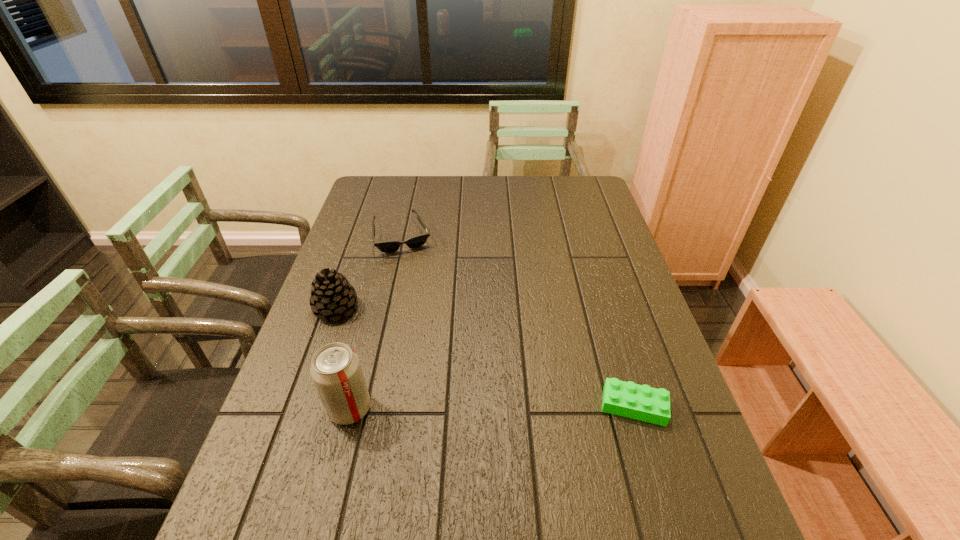
I want to click on soda can, so click(x=336, y=371).

You are a GUI agent. You are given a task and a screenshot of the screen. Output one action in this format:
    pyautogui.click(x=<x>, y=<y>)
    Task: Click on the Lego
    
    Given the screenshot: What is the action you would take?
    pyautogui.click(x=641, y=402)

The height and width of the screenshot is (540, 960). In order to click on the second farthest object in this screenshot , I will do `click(332, 296)`.

Locate an element on the screen. The image size is (960, 540). the third shortest object is located at coordinates (332, 296).

You are a GUI agent. You are given a task and a screenshot of the screen. Output one action in this format:
    pyautogui.click(x=<x>, y=<y>)
    Task: Click on the sunglasses
    
    Given the screenshot: What is the action you would take?
    pyautogui.click(x=416, y=241)

At what (x,y) coordinates should I click in order to perform the action: click on vacant space located on the right of the soda can. Please return your answer as a coordinate pair (x, y). This screenshot has width=960, height=540. Looking at the image, I should click on (510, 408).

Find the location of a particular element. Image resolution: width=960 pixels, height=540 pixels. free location located on the left of the rightmost object is located at coordinates click(x=498, y=406).

Find the location of a particular element. free space located 0.240m at the narrow end of the second tallest object is located at coordinates (415, 361).

Locate an element on the screen. vacant space situated 0.370m at the narrow end of the second tallest object is located at coordinates (455, 389).

Where is `free region located 0.350m at the narrow end of the second tallest object`? The height and width of the screenshot is (540, 960). free region located 0.350m at the narrow end of the second tallest object is located at coordinates (448, 384).